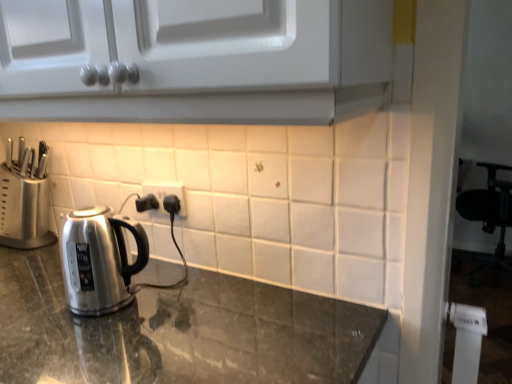
This screenshot has height=384, width=512. I want to click on white plastic electric outlet at center, so click(166, 194).

The height and width of the screenshot is (384, 512). In order to click on shiny granite countertop at center in this screenshot , I will do `click(177, 331)`.

Who is bigger, shiny granite countertop at center or white plastic electric outlet at center?

With larger size is shiny granite countertop at center.

Would you say shiny granite countertop at center is a long distance from white plastic electric outlet at center?

No, shiny granite countertop at center is not far away from white plastic electric outlet at center.

Would you say shiny granite countertop at center is to the left or to the right of white plastic electric outlet at center in the picture?

shiny granite countertop at center is positioned on white plastic electric outlet at center's left side.

Does point (268, 354) lie in front of point (181, 213)?

Yes, it is in front of point (181, 213).

Which is behind, point (149, 191) or point (8, 232)?

The point (8, 232) is farther.

How different are the orientations of white plastic electric outlet at center and satin silver knife block at left in degrees?

The angle between the facing direction of white plastic electric outlet at center and the facing direction of satin silver knife block at left is 90.4 degrees.

You are a GUI agent. You are given a task and a screenshot of the screen. Output one action in this format:
    pyautogui.click(x=<x>, y=<y>)
    Task: Click on the appliance on the left of the white plastic electric outlet at center
    
    Given the screenshot: What is the action you would take?
    pyautogui.click(x=24, y=210)

Is satin silver knife block at left thinner than shiny granite countertop at center?

Yes.

Considering the positions of points (16, 210) and (86, 379), is point (16, 210) farther from camera compared to point (86, 379)?

Yes, it is behind point (86, 379).

From a real-world perspective, is satin silver knife block at left physically above shiny granite countertop at center?

Yes, from a real-world perspective, satin silver knife block at left is above shiny granite countertop at center.

Considering the sizes of objects satin silver knife block at left and shiny granite countertop at center in the image provided, who is shorter, satin silver knife block at left or shiny granite countertop at center?

satin silver knife block at left is shorter.

Is shiny granite countertop at center oriented towards satin silver knife block at left?

No.

Is point (157, 351) positioned before point (20, 195)?

Yes, it is in front of point (20, 195).

I want to click on countertop on the right side of satin silver knife block at left, so click(x=177, y=331).

From a real-world perspective, is white plastic electric outlet at center positioned over shiny granite countertop at center based on gravity?

Indeed, from a real-world perspective, white plastic electric outlet at center stands above shiny granite countertop at center.

From the picture: Is white plastic electric outlet at center smaller than shiny granite countertop at center?

Correct, white plastic electric outlet at center occupies less space than shiny granite countertop at center.

From the image's perspective, which is below, white plastic electric outlet at center or shiny granite countertop at center?

shiny granite countertop at center, from the image's perspective.

Between white plastic electric outlet at center and shiny granite countertop at center, which one appears on the right side from the viewer's perspective?

Positioned to the right is white plastic electric outlet at center.

Does satin silver knife block at left have a lesser width compared to white plastic electric outlet at center?

No.

Locate an element on the screen. The width and height of the screenshot is (512, 384). appliance behind the white plastic electric outlet at center is located at coordinates (24, 210).

Is satin silver knife block at left surrounding white plastic electric outlet at center?

No, satin silver knife block at left does not contain white plastic electric outlet at center.

Locate an element on the screen. electric outlet located on the right of shiny granite countertop at center is located at coordinates (166, 194).

Image resolution: width=512 pixels, height=384 pixels. In order to click on appliance to the left of white plastic electric outlet at center in this screenshot , I will do `click(24, 210)`.

Based on their spatial positions, is satin silver knife block at left or white plastic electric outlet at center closer to shiny granite countertop at center?

white plastic electric outlet at center lies closer to shiny granite countertop at center than the other object.

Looking at the image, which one is located further to satin silver knife block at left, shiny granite countertop at center or white plastic electric outlet at center?

Based on the image, shiny granite countertop at center appears to be further to satin silver knife block at left.

When comparing their distances from satin silver knife block at left, does white plastic electric outlet at center or shiny granite countertop at center seem closer?

white plastic electric outlet at center is closer to satin silver knife block at left.

When comparing their distances from white plastic electric outlet at center, does shiny granite countertop at center or satin silver knife block at left seem further?

The object further to white plastic electric outlet at center is satin silver knife block at left.

Looking at the image, which one is located further to white plastic electric outlet at center, satin silver knife block at left or shiny granite countertop at center?

satin silver knife block at left is further to white plastic electric outlet at center.

Based on their spatial positions, is white plastic electric outlet at center or satin silver knife block at left further from shiny granite countertop at center?

Based on the image, satin silver knife block at left appears to be further to shiny granite countertop at center.

Where is `electric outlet between shiny granite countertop at center and satin silver knife block at left in the front-back direction`? electric outlet between shiny granite countertop at center and satin silver knife block at left in the front-back direction is located at coordinates pyautogui.click(x=166, y=194).